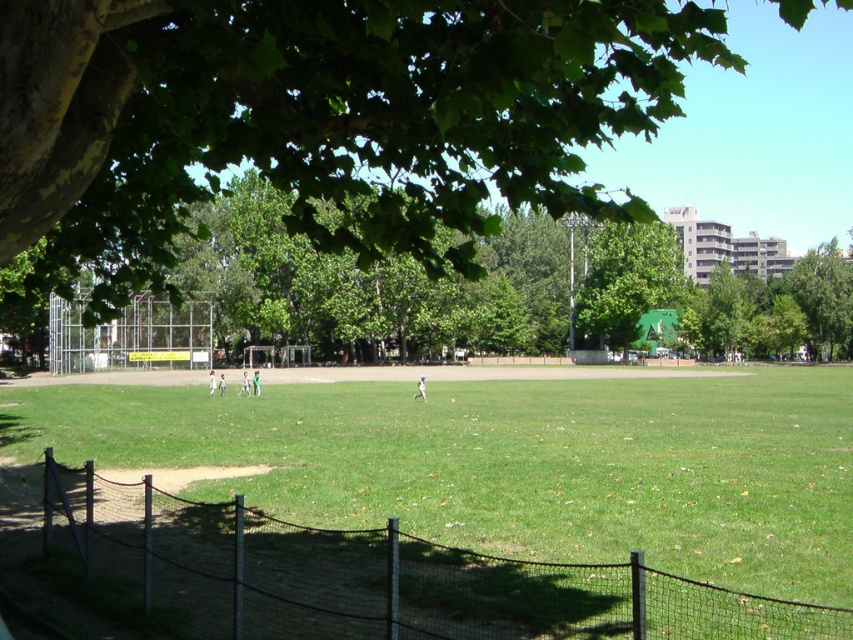
You are standing at the edge of the park and want to walk towards the green leafy tree at center. Which direction should you walk to avoid the black mesh fence at lower left?

You should walk to the right side of the green leafy tree at center because the black mesh fence at lower left is on its left side.

You are standing at the edge of the park and want to walk to the green leafy tree at center. There is a metallic wire fence at left in your way. Which direction should you avoid to reach the tree?

You should avoid going to the left because the metallic wire fence at left is positioned on the left side of the green leafy tree at center, so moving left would take you away from the tree.

You are standing at the edge of the park and want to walk from the metallic wire fence at left to the green leafy tree at center. Which direction should you move in to get closer to the tree?

To get closer to the green leafy tree at center, you should move towards the center of the field from the metallic wire fence at left since the tree is located centrally in the park.